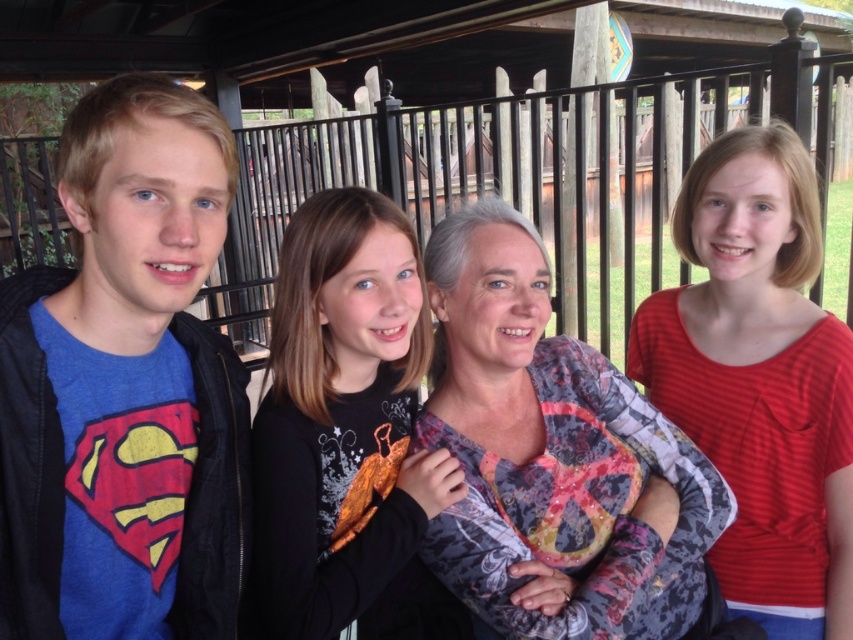
Can you confirm if blue cotton t-shirt at left is taller than printed fabric blouse at center?

Correct, blue cotton t-shirt at left is much taller as printed fabric blouse at center.

Between blue cotton t-shirt at left and printed fabric blouse at center, which one is positioned higher?

blue cotton t-shirt at left

Which is in front, point (146, 573) or point (596, 458)?

Point (146, 573) is in front.

Find the location of a particular element. The image size is (853, 640). blue cotton t-shirt at left is located at coordinates (125, 387).

In the scene shown: Is printed fabric blouse at center to the right of black matte shirt at center from the viewer's perspective?

Correct, you'll find printed fabric blouse at center to the right of black matte shirt at center.

Image resolution: width=853 pixels, height=640 pixels. Describe the element at coordinates (550, 451) in the screenshot. I see `printed fabric blouse at center` at that location.

I want to click on printed fabric blouse at center, so click(x=550, y=451).

Is red striped shirt at right to the left of black matte shirt at center from the viewer's perspective?

In fact, red striped shirt at right is to the right of black matte shirt at center.

Which is above, red striped shirt at right or black matte shirt at center?

red striped shirt at right is higher up.

Is point (808, 404) more distant than point (379, 211)?

Yes.

Locate an element on the screen. The height and width of the screenshot is (640, 853). red striped shirt at right is located at coordinates (759, 380).